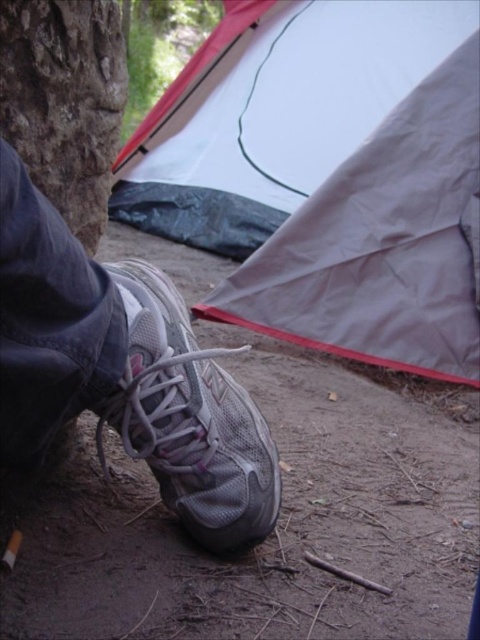
You are navigating through a campsite and need to place two markers at specific coordinates. The first marker must be placed at point (24, 170) and the second at point (271, 458). Which marker will be closer to the front of the scene?

The marker at point (24, 170) will be closer to the front of the scene because it is positioned in front of point (271, 458) according to the spatial relationship provided.

You are a photographer trying to capture a closeup of the gray mesh shoe at lower left and the white mesh shoe at lower left. Since both shoes are at the lower left, which one would appear closer to the camera in the photo?

The gray mesh shoe at lower left is in front of the white mesh shoe at lower left, so it would appear closer to the camera in the photo.